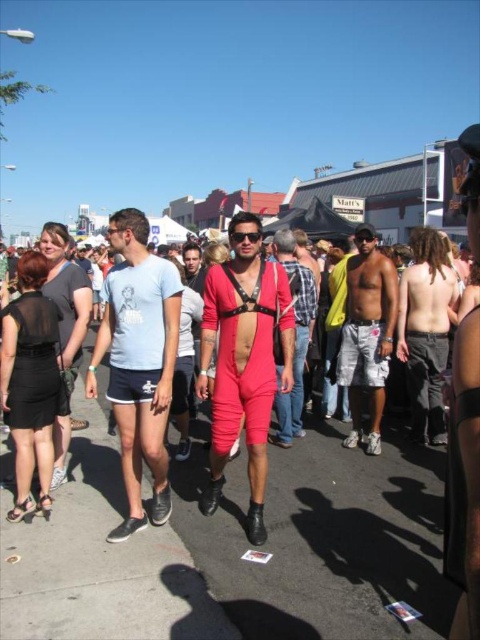
Based on the photo, you are a fashion designer observing the crowd at Matts festival. You notice two items worn by a person at the center of the image. Which item has a greater width between the white cotton shorts at center and the black plastic goggles at center?

The white cotton shorts at center has a greater width than the black plastic goggles at center.